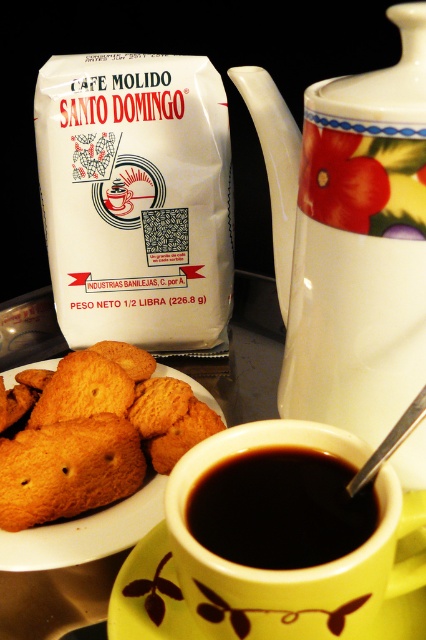
Question: Which object appears closest to the camera in this image?

Choices:
 (A) yellow ceramic saucer at lower center
 (B) black matte cup at center

Answer: (A)

Question: Which point is farther to the camera?

Choices:
 (A) (65, 451)
 (B) (262, 528)

Answer: (A)

Question: Does golden crispy cookie at center appear on the left side of black matte cup at center?

Choices:
 (A) no
 (B) yes

Answer: (B)

Question: Does white glossy teapot at upper right appear on the right side of golden crispy cookie at center?

Choices:
 (A) yes
 (B) no

Answer: (A)

Question: Does white glossy teapot at upper right appear under golden crispy cookie at center?

Choices:
 (A) yes
 (B) no

Answer: (B)

Question: Based on their relative distances, which object is farther from the white glossy teapot at upper right?

Choices:
 (A) black matte cup at center
 (B) yellow ceramic saucer at lower center
 (C) golden crispy cookie at center

Answer: (B)